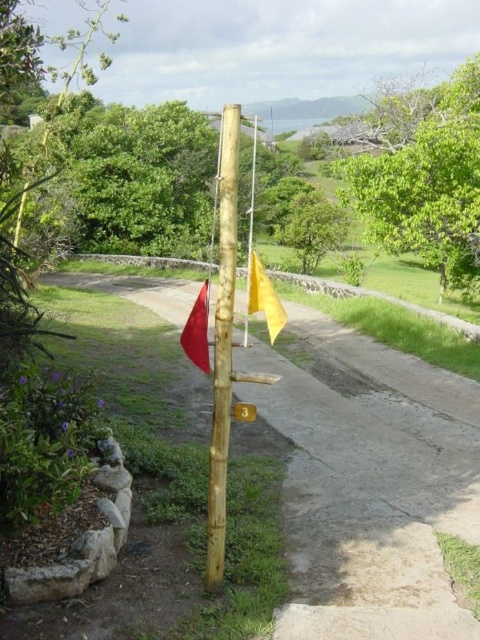
Question: Considering the real-world distances, which object is farthest from the smooth red flag at left?

Choices:
 (A) green leafy tree at center
 (B) wooden post at center
 (C) yellow fabric flag at center
 (D) yellow matte flag at center

Answer: (A)

Question: Which of the following is the closest to the observer?

Choices:
 (A) (262, 300)
 (B) (199, 292)

Answer: (A)

Question: Is green leafy tree at upper center positioned in front of natural wood pole at center?

Choices:
 (A) yes
 (B) no

Answer: (B)

Question: Which point is closer to the camera?

Choices:
 (A) yellow matte flag at center
 (B) yellow fabric flag at center
 (C) smooth red flag at left

Answer: (C)

Question: Can you confirm if green leafy tree at center is bigger than yellow matte flag at center?

Choices:
 (A) yes
 (B) no

Answer: (B)

Question: Does wooden post at center have a larger size compared to yellow fabric flag at center?

Choices:
 (A) no
 (B) yes

Answer: (A)